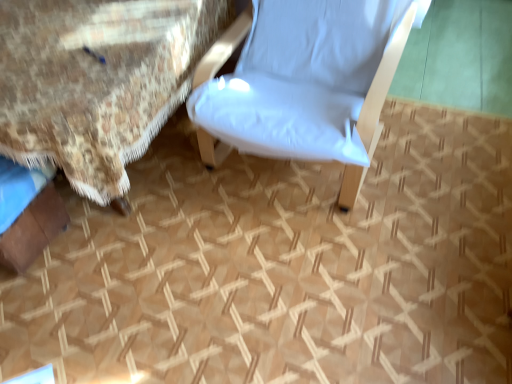
Question: Based on their positions, is floral fabric bed at center located to the left or right of white fabric chair at center?

Choices:
 (A) left
 (B) right

Answer: (A)

Question: Is floral fabric bed at center taller or shorter than white fabric chair at center?

Choices:
 (A) tall
 (B) short

Answer: (B)

Question: Is floral fabric bed at center bigger or smaller than white fabric chair at center?

Choices:
 (A) small
 (B) big

Answer: (B)

Question: Would you say white fabric chair at center is inside or outside floral fabric bed at center?

Choices:
 (A) outside
 (B) inside

Answer: (A)

Question: In the image, is white fabric chair at center positioned in front of or behind floral fabric bed at center?

Choices:
 (A) front
 (B) behind

Answer: (A)

Question: Based on their sizes in the image, would you say white fabric chair at center is bigger or smaller than floral fabric bed at center?

Choices:
 (A) small
 (B) big

Answer: (A)

Question: In terms of height, does white fabric chair at center look taller or shorter compared to floral fabric bed at center?

Choices:
 (A) short
 (B) tall

Answer: (B)